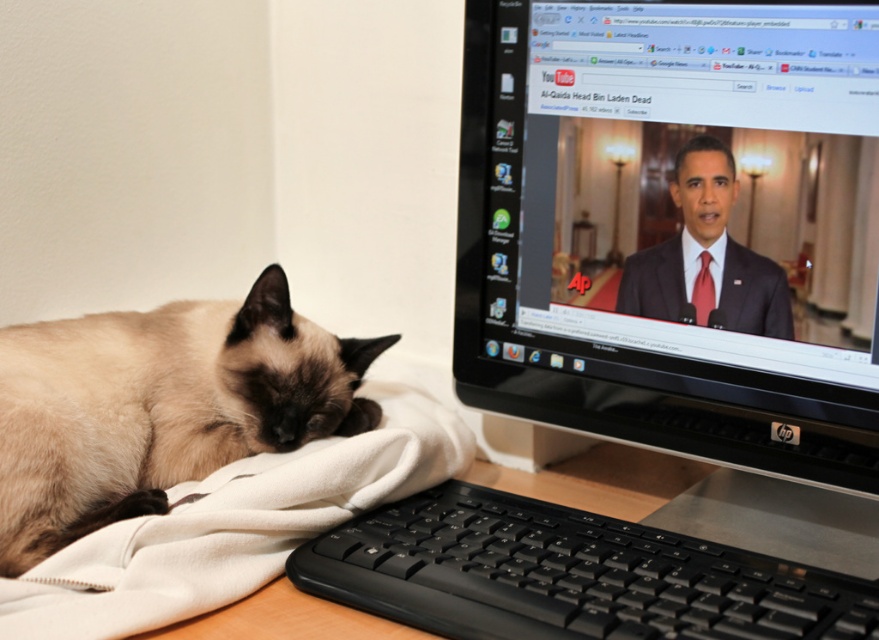
Can you confirm if smokey brown fur at lower left is positioned to the right of white soft blanket at lower left?

In fact, smokey brown fur at lower left is to the left of white soft blanket at lower left.

Does smokey brown fur at lower left come behind white soft blanket at lower left?

That is True.

Which is behind, point (316, 340) or point (84, 588)?

Positioned behind is point (316, 340).

Where is `smokey brown fur at lower left`? The image size is (879, 640). smokey brown fur at lower left is located at coordinates (158, 406).

How much distance is there between black plastic monitor at upper right and black plastic keyboard at lower center?

They are 3.55 inches apart.

I want to click on black plastic monitor at upper right, so click(x=644, y=332).

Which is in front, point (556, 422) or point (404, 525)?

Point (404, 525) is more forward.

I want to click on black plastic monitor at upper right, so click(644, 332).

Is black plastic monitor at upper right bigger than smokey brown fur at lower left?

Yes.

Which is above, black plastic monitor at upper right or smokey brown fur at lower left?

Positioned higher is black plastic monitor at upper right.

Does point (746, 410) come behind point (238, 364)?

No.

This screenshot has width=879, height=640. Identify the location of black plastic monitor at upper right. coord(644,332).